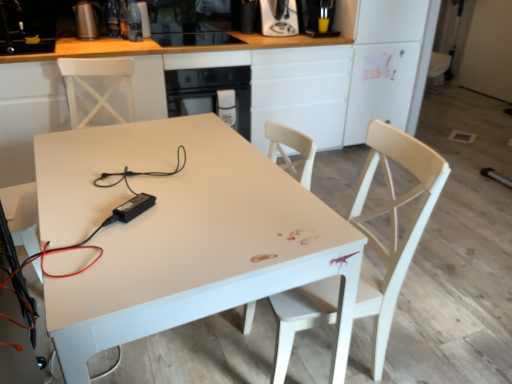
Question: From a real-world perspective, is white glossy table at center physically located above or below white glossy cabinet at center?

Choices:
 (A) below
 (B) above

Answer: (A)

Question: Is white glossy table at center bigger or smaller than white glossy cabinet at center?

Choices:
 (A) big
 (B) small

Answer: (B)

Question: Which object is the farthest from the black plastic power adapter at center, the 3th appliance from the left?

Choices:
 (A) satin silver coffee machine at upper center, arranged as the first coffee machine when viewed from the left
 (B) white glossy table at center
 (C) clear glass bottle at upper center, the second appliance positioned from the right
 (D) metallic silver coffee machine at upper right, arranged as the 2th coffee machine when viewed from the left
 (E) white wood chair at right

Answer: (D)

Question: Which is farther from the metallic silver kettle at upper left, the 3th appliance positioned from the front?

Choices:
 (A) white glossy table at center
 (B) white wood chair at right
 (C) metallic silver coffee machine at upper right, arranged as the 2th coffee machine when viewed from the left
 (D) clear glass bottle at upper center, placed as the second appliance when sorted from left to right
 (E) black glass oven at center

Answer: (B)